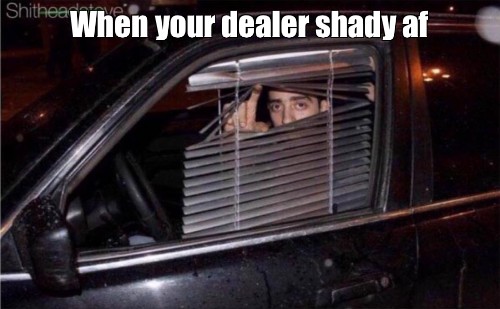
Find the location of a particular element. blinds is located at coordinates (303, 176), (289, 65).